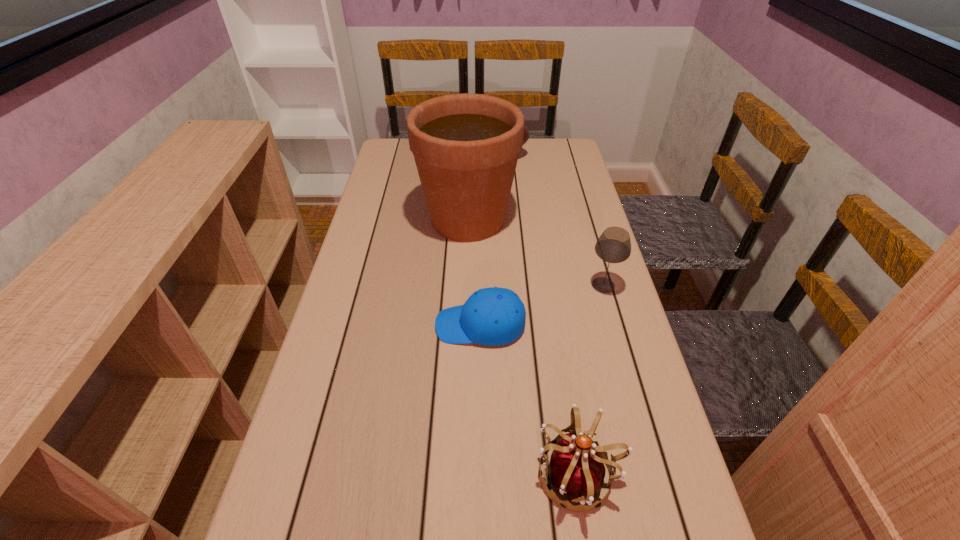
This screenshot has width=960, height=540. Find the location of `vacant space located on the front of the rightmost object`. vacant space located on the front of the rightmost object is located at coordinates (646, 436).

Find the location of a particular element. The height and width of the screenshot is (540, 960). free space located on the front-facing side of the nearest object is located at coordinates (449, 474).

I want to click on vacant region located 0.390m on the front-facing side of the nearest object, so click(325, 474).

At what (x,y) coordinates should I click in order to perform the action: click on vacant space located 0.080m on the front-facing side of the nearest object. Please return your answer as a coordinate pair (x, y). This screenshot has height=540, width=960. Looking at the image, I should click on (492, 474).

I want to click on vacant space located on the front-facing side of the second nearest object, so click(x=398, y=325).

Locate an element on the screen. vacant space located 0.080m on the front-facing side of the second nearest object is located at coordinates (402, 325).

You are a GUI agent. You are given a task and a screenshot of the screen. Output one action in this format:
    pyautogui.click(x=<x>, y=<y>)
    Task: Click on the vacant area situated 0.090m on the front-facing side of the second nearest object
    The height and width of the screenshot is (540, 960).
    Given the screenshot: What is the action you would take?
    pyautogui.click(x=398, y=325)

Identify the location of object situated at the far edge. (526, 133).

Where is `wineglass present at the right edge`? The height and width of the screenshot is (540, 960). wineglass present at the right edge is located at coordinates (614, 245).

Image resolution: width=960 pixels, height=540 pixels. I want to click on tiara that is at the right edge, so click(576, 469).